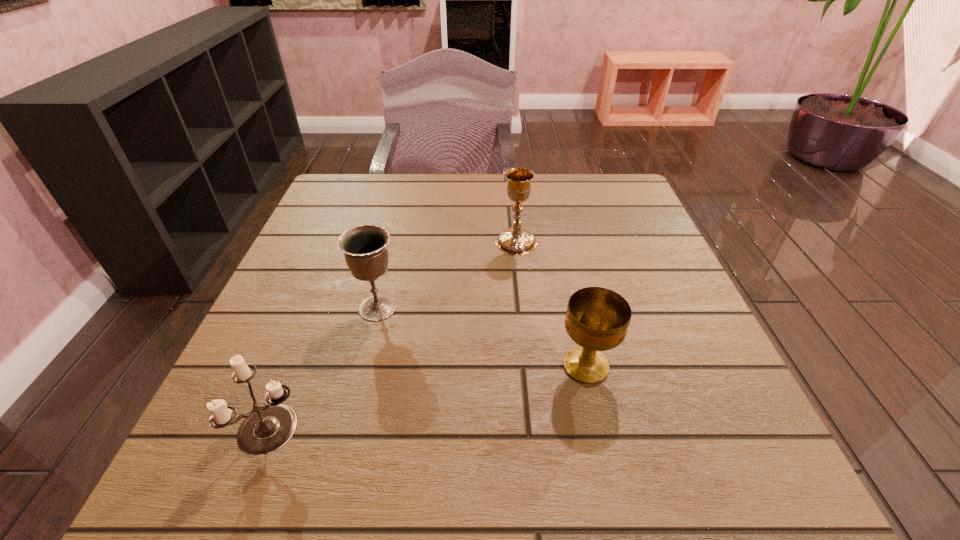
Image resolution: width=960 pixels, height=540 pixels. I want to click on free spot between the second chalice from left to right and the second nearest chalice, so click(447, 275).

Where is `vacant space that's between the rightmost object and the farthest chalice`? vacant space that's between the rightmost object and the farthest chalice is located at coordinates (551, 304).

In order to click on object that ranks as the closest to the candle holder in this screenshot , I will do `click(365, 249)`.

Identify the location of object that is the second nearest to the shortest chalice. (365, 249).

Find the location of a particular element. chalice identified as the second closest to the rightmost object is located at coordinates (365, 249).

Identify which chalice is the nearest to the rightmost chalice. Please provide its 2D coordinates. Your answer should be formatted as a tuple, i.e. [(x, y)], where the tuple contains the x and y coordinates of a point satisfying the conditions above.

[(516, 241)]

What are the coordinates of `vacant area that satisfies the following two spatial constraints: 1. on the back side of the second chalice from left to right; 2. on the right side of the nearest object` in the screenshot? It's located at (345, 242).

Identify the location of vacant space that satisfies the following two spatial constraints: 1. on the back side of the farthest chalice; 2. on the right side of the nearest object. Image resolution: width=960 pixels, height=540 pixels. (345, 242).

The width and height of the screenshot is (960, 540). I want to click on vacant point that satisfies the following two spatial constraints: 1. on the back side of the third farthest object; 2. on the left side of the leftmost object, so click(297, 366).